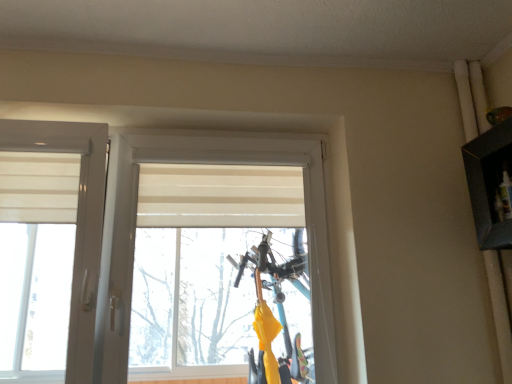
What is the approximate width of white matte window at center?

It is 20.52 centimeters.

Describe the element at coordinates (135, 224) in the screenshot. I see `white matte window at center` at that location.

I want to click on white matte window at center, so click(x=135, y=224).

Where is `white matte window at center`? This screenshot has width=512, height=384. white matte window at center is located at coordinates (135, 224).